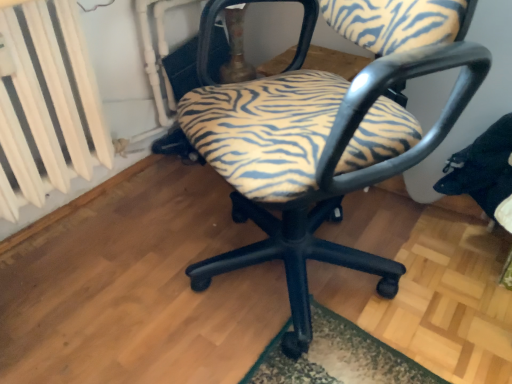
Question: Is white painted metal radiator at left inside or outside of zebra-patterned fabric chair at center?

Choices:
 (A) inside
 (B) outside

Answer: (B)

Question: Considering the relative positions of white painted metal radiator at left and zebra-patterned fabric chair at center in the image provided, is white painted metal radiator at left to the left or to the right of zebra-patterned fabric chair at center?

Choices:
 (A) right
 (B) left

Answer: (B)

Question: From a real-world perspective, is white painted metal radiator at left physically located above or below zebra-patterned fabric chair at center?

Choices:
 (A) above
 (B) below

Answer: (A)

Question: From a real-world perspective, is zebra-patterned fabric chair at center positioned above or below white painted metal radiator at left?

Choices:
 (A) above
 (B) below

Answer: (B)

Question: Is zebra-patterned fabric chair at center to the left or to the right of white painted metal radiator at left in the image?

Choices:
 (A) left
 (B) right

Answer: (B)

Question: Considering their positions, is zebra-patterned fabric chair at center located in front of or behind white painted metal radiator at left?

Choices:
 (A) front
 (B) behind

Answer: (A)

Question: Is zebra-patterned fabric chair at center wider or thinner than white painted metal radiator at left?

Choices:
 (A) thin
 (B) wide

Answer: (B)